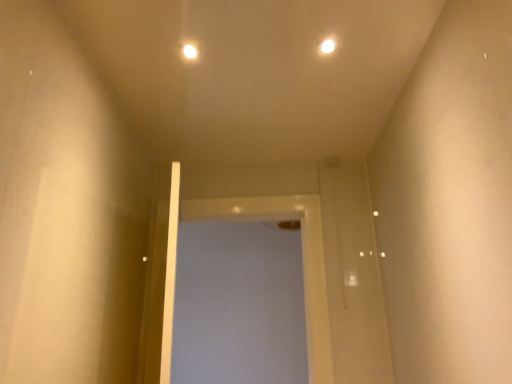
Question: Can you confirm if white glossy screen door at center is positioned to the right of white glossy light at upper center, acting as the 1th light starting from the right?

Choices:
 (A) no
 (B) yes

Answer: (A)

Question: Is white glossy screen door at center facing towards white glossy light at upper center, acting as the 1th light starting from the right?

Choices:
 (A) yes
 (B) no

Answer: (A)

Question: Is white glossy screen door at center closer to camera compared to white glossy light at upper center, acting as the 1th light starting from the right?

Choices:
 (A) yes
 (B) no

Answer: (B)

Question: Does white glossy screen door at center appear on the left side of white glossy light at upper center, the 2th light in the left-to-right sequence?

Choices:
 (A) yes
 (B) no

Answer: (A)

Question: Can you confirm if white glossy screen door at center is taller than white glossy light at upper center, acting as the 1th light starting from the right?

Choices:
 (A) no
 (B) yes

Answer: (B)

Question: From the image's perspective, is white glossy screen door at center located above white glossy light at upper center, the 2th light in the left-to-right sequence?

Choices:
 (A) no
 (B) yes

Answer: (A)

Question: Can white glossy screen door at center be found inside white glossy light at upper center, acting as the 1th light starting from the right?

Choices:
 (A) no
 (B) yes

Answer: (A)

Question: Is white glossy light at upper center, acting as the 1th light starting from the right, closer to camera compared to white glossy screen door at center?

Choices:
 (A) yes
 (B) no

Answer: (A)

Question: From a real-world perspective, is white glossy light at upper center, the 2th light in the left-to-right sequence, positioned under white glossy screen door at center based on gravity?

Choices:
 (A) yes
 (B) no

Answer: (B)

Question: From the image's perspective, is white glossy light at upper center, the 2th light in the left-to-right sequence, under white glossy screen door at center?

Choices:
 (A) no
 (B) yes

Answer: (A)

Question: Does white glossy light at upper center, the 2th light in the left-to-right sequence, lie behind white glossy screen door at center?

Choices:
 (A) yes
 (B) no

Answer: (B)

Question: Is white glossy light at upper center, the 2th light in the left-to-right sequence, smaller than white glossy screen door at center?

Choices:
 (A) yes
 (B) no

Answer: (A)

Question: Is white glossy screen door at center placed right next to white glossy light at upper center, the second light positioned from the right?

Choices:
 (A) no
 (B) yes

Answer: (A)